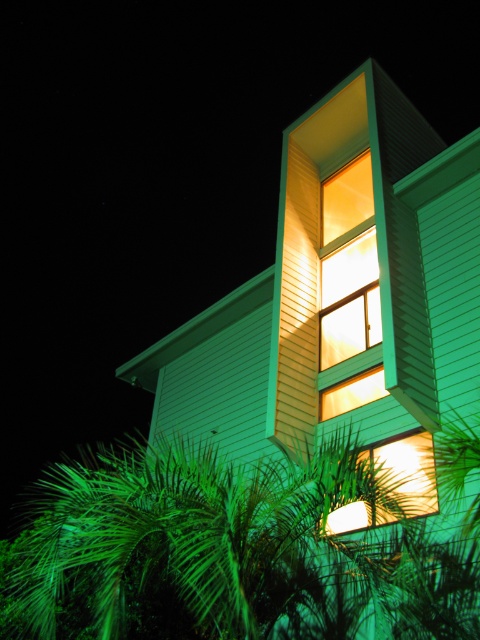
You are standing in front of the modern architectural structure at night. You want to take a photo of the matte glass window at center using a camera. The camera requires a minimum distance of 30 feet to focus properly. Will you be able to take a clear photo?

The matte glass window at center and camera are 30.11 feet apart from each other, which is just over the required 30 feet minimum distance. Therefore, you can take a clear photo.